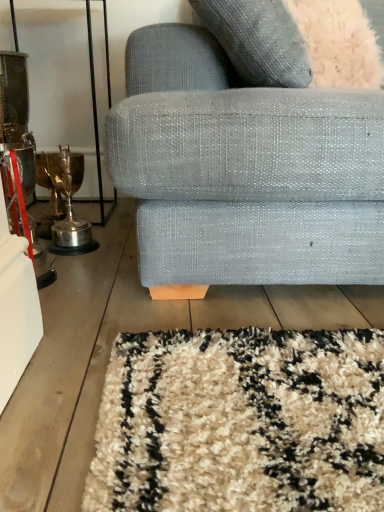
Question: From a real-world perspective, does textured gray couch at center stand above fuzzy gray throw pillow at upper right?

Choices:
 (A) yes
 (B) no

Answer: (B)

Question: Is textured gray couch at center not within fuzzy gray throw pillow at upper right?

Choices:
 (A) no
 (B) yes

Answer: (B)

Question: From a real-world perspective, is textured gray couch at center physically below fuzzy gray throw pillow at upper right?

Choices:
 (A) no
 (B) yes

Answer: (B)

Question: Is textured gray couch at center shorter than fuzzy gray throw pillow at upper right?

Choices:
 (A) yes
 (B) no

Answer: (B)

Question: Can you confirm if textured gray couch at center is wider than fuzzy gray throw pillow at upper right?

Choices:
 (A) no
 (B) yes

Answer: (B)

Question: Are textured gray couch at center and fuzzy gray throw pillow at upper right located far from each other?

Choices:
 (A) no
 (B) yes

Answer: (A)

Question: Is fuzzy gray throw pillow at upper right to the left of textured gray couch at center from the viewer's perspective?

Choices:
 (A) yes
 (B) no

Answer: (B)

Question: Can you confirm if fuzzy gray throw pillow at upper right is wider than textured gray couch at center?

Choices:
 (A) no
 (B) yes

Answer: (A)

Question: Is fuzzy gray throw pillow at upper right oriented away from textured gray couch at center?

Choices:
 (A) yes
 (B) no

Answer: (A)

Question: Can you confirm if fuzzy gray throw pillow at upper right is taller than textured gray couch at center?

Choices:
 (A) no
 (B) yes

Answer: (A)

Question: From the image's perspective, does fuzzy gray throw pillow at upper right appear higher than textured gray couch at center?

Choices:
 (A) yes
 (B) no

Answer: (A)

Question: Is fuzzy gray throw pillow at upper right beside textured gray couch at center?

Choices:
 (A) yes
 (B) no

Answer: (B)

Question: From the image's perspective, is textured gray couch at center positioned above or below fuzzy gray throw pillow at upper right?

Choices:
 (A) below
 (B) above

Answer: (A)